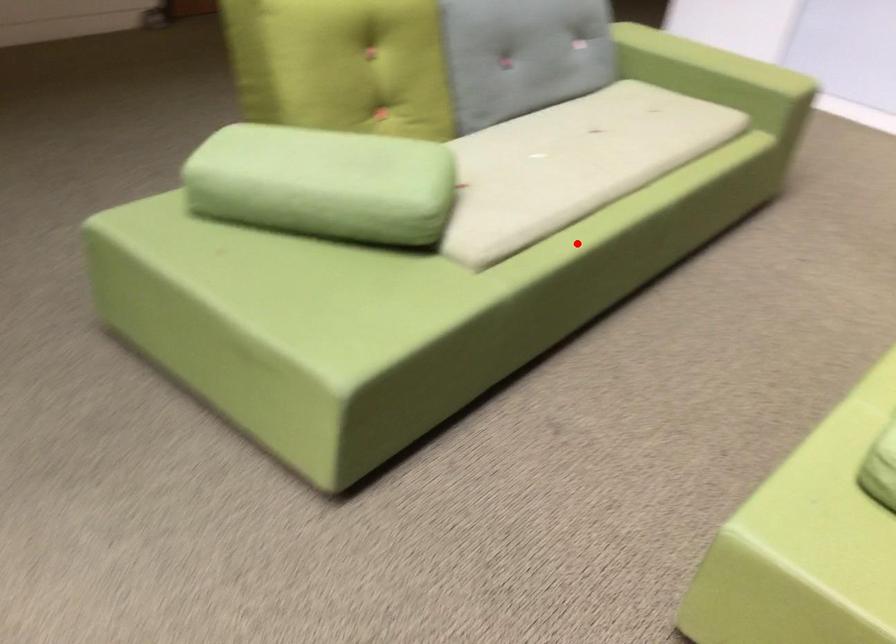
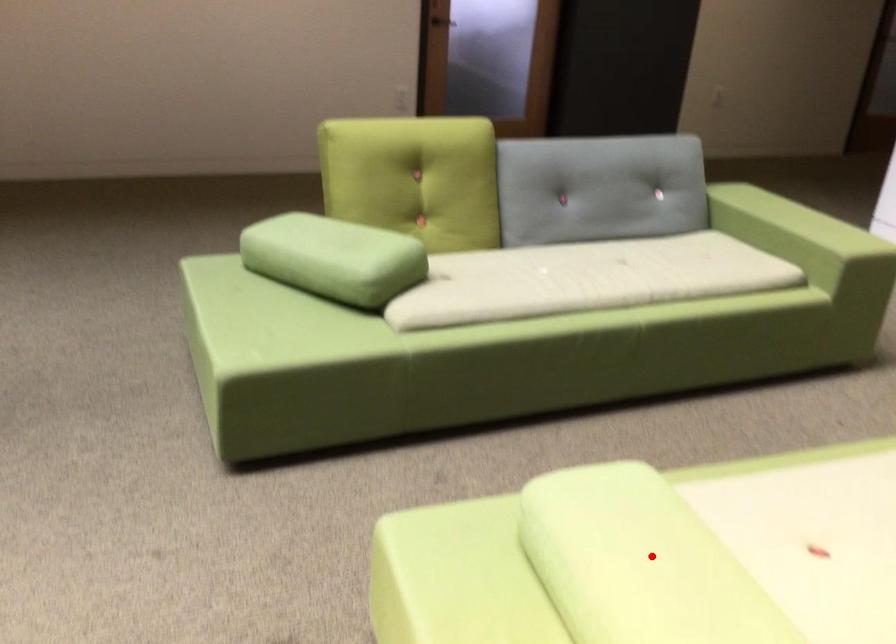
I am providing you with two images of the same scene from different viewpoints. A red point is marked on the first image and another point is marked on the second image. Is the red point in image1 aligned with the point shown in image2?

No